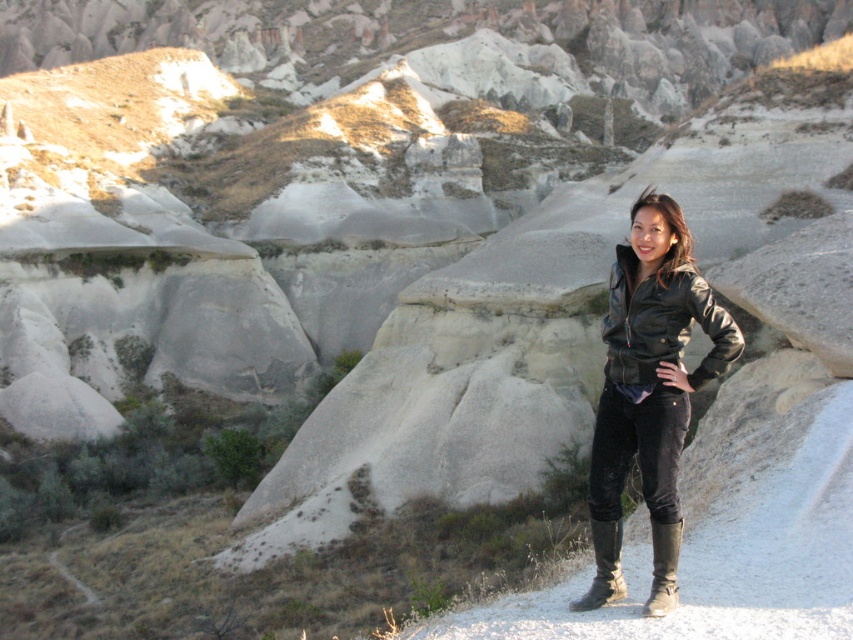
Question: Is leather jacket at center to the left of brown suede boot at lower right from the viewer's perspective?

Choices:
 (A) yes
 (B) no

Answer: (B)

Question: Is leather jacket at center below brown suede boot at lower right?

Choices:
 (A) no
 (B) yes

Answer: (A)

Question: Which object is the closest to the leather jacket at center?

Choices:
 (A) black leather jacket at right
 (B) brown suede boot at lower right
 (C) black leather boot at lower right

Answer: (A)

Question: Which point is closer to the camera?

Choices:
 (A) (675, 596)
 (B) (728, 324)
 (C) (619, 548)

Answer: (A)

Question: Considering the real-world distances, which object is closest to the leather jacket at center?

Choices:
 (A) brown suede boot at lower right
 (B) black leather jacket at right

Answer: (B)

Question: Is leather jacket at center below brown suede boot at lower right?

Choices:
 (A) no
 (B) yes

Answer: (A)